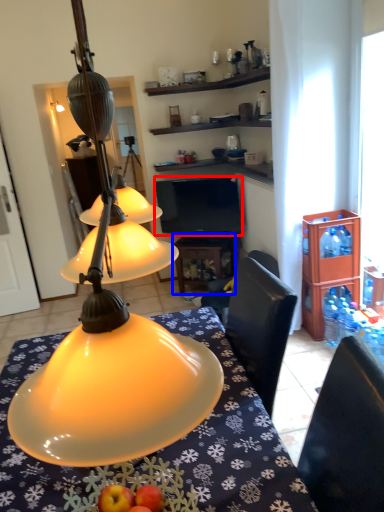
Question: Among these objects, which one is nearest to the camera, television (highlighted by a red box) or table (highlighted by a blue box)?

Choices:
 (A) television
 (B) table

Answer: (A)